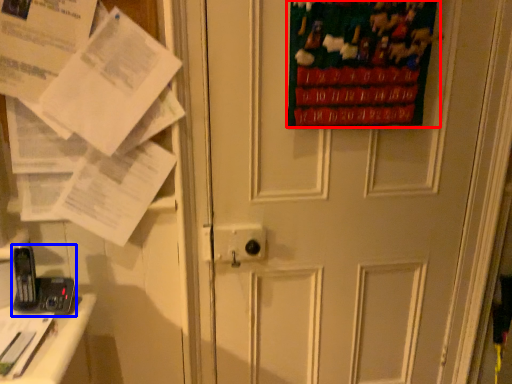
Question: Among these objects, which one is farthest to the camera, poster page (highlighted by a red box) or equipment (highlighted by a blue box)?

Choices:
 (A) poster page
 (B) equipment

Answer: (B)